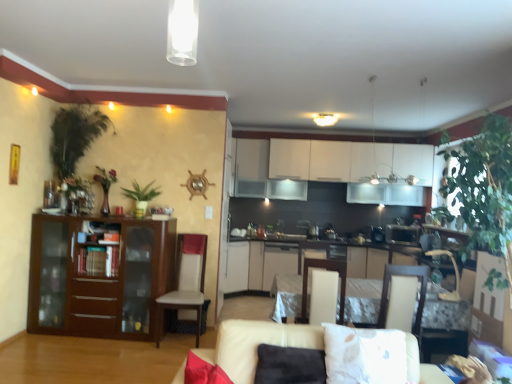
Question: In which direction should I rotate to look at metallic silver armchair at center, the third armchair viewed from the left?

Choices:
 (A) right
 (B) left

Answer: (A)

Question: Does metallic silver armchair at center, which is counted as the first armchair, starting from the right, turn towards white cardboard box at lower right?

Choices:
 (A) yes
 (B) no

Answer: (B)

Question: Is metallic silver armchair at center, which is counted as the first armchair, starting from the right, at the left side of white cardboard box at lower right?

Choices:
 (A) no
 (B) yes

Answer: (B)

Question: Considering the relative sizes of metallic silver armchair at center, the third armchair viewed from the left, and white cardboard box at lower right in the image provided, is metallic silver armchair at center, the third armchair viewed from the left, bigger than white cardboard box at lower right?

Choices:
 (A) no
 (B) yes

Answer: (A)

Question: Is metallic silver armchair at center, the third armchair viewed from the left, with white cardboard box at lower right?

Choices:
 (A) no
 (B) yes

Answer: (A)

Question: Is metallic silver armchair at center, which is counted as the first armchair, starting from the right, wider than white cardboard box at lower right?

Choices:
 (A) no
 (B) yes

Answer: (A)

Question: Is beige fabric couch at lower center smaller than white leather chair at left?

Choices:
 (A) yes
 (B) no

Answer: (B)

Question: Is beige fabric couch at lower center not within white leather chair at left?

Choices:
 (A) yes
 (B) no

Answer: (A)

Question: Is beige fabric couch at lower center oriented away from white leather chair at left?

Choices:
 (A) no
 (B) yes

Answer: (B)

Question: From a real-world perspective, is beige fabric couch at lower center located higher than white leather chair at left?

Choices:
 (A) no
 (B) yes

Answer: (A)

Question: Is white leather chair at left a part of beige fabric couch at lower center?

Choices:
 (A) yes
 (B) no

Answer: (B)

Question: From the image's perspective, is beige fabric couch at lower center beneath white leather chair at left?

Choices:
 (A) yes
 (B) no

Answer: (A)

Question: Is white fabric armchair at center, the second armchair from the right, further to the viewer compared to beige fabric couch at lower center?

Choices:
 (A) yes
 (B) no

Answer: (A)